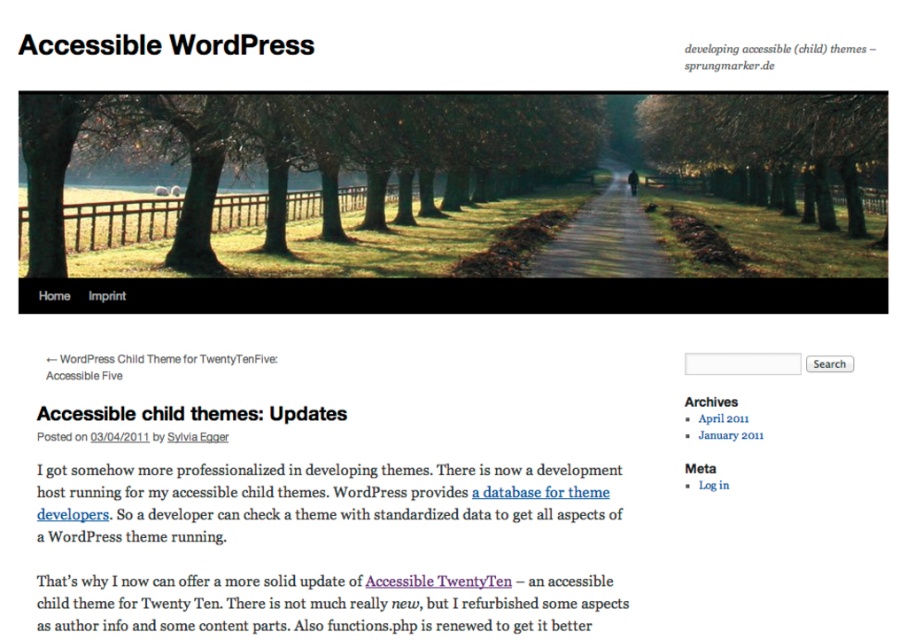
Looking at this image, you are a website designer reviewing the webpage layout. You notice the green matte tree at center and the brown dirt path at center. Which object is located to the left of the other?

The green matte tree at center is positioned on the left side of brown dirt path at center.

You are a web developer trying to place a new button on the webpage. The button should be placed to the right of the brown textured tree at center. Where should you place the button?

The brown textured tree at center is located at point [769,140]. To place the button to the right of it, you should position the button at a point with an x coordinate greater than 0.220 and the same y coordinate, such as [769,160].

You are designing a website layout and need to place two trees from the image in a row. The green matte tree at center and the brown textured tree at center must be placed next to each other. According to the image, which tree should be placed to the left of the other?

The green matte tree at center should be placed to the left of the brown textured tree at center because the green matte tree at center is positioned on the left side of brown textured tree at center in the image.